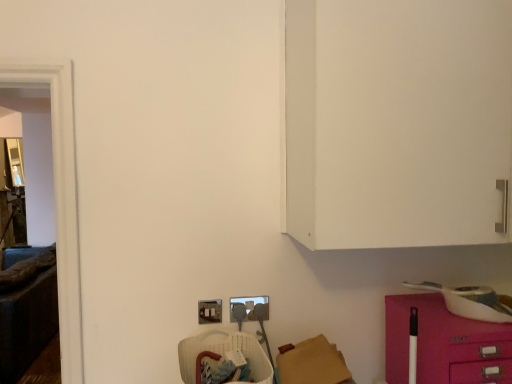
Question: From the image's perspective, is transparent glass door at left beneath metallic silver electric outlet at lower center, which is the 2th electric outlet from right to left?

Choices:
 (A) no
 (B) yes

Answer: (A)

Question: From the image's perspective, would you say transparent glass door at left is positioned over metallic silver electric outlet at lower center, which is the 2th electric outlet from right to left?

Choices:
 (A) yes
 (B) no

Answer: (A)

Question: Can you confirm if transparent glass door at left is thinner than metallic silver electric outlet at lower center, arranged as the 1th electric outlet when viewed from the left?

Choices:
 (A) yes
 (B) no

Answer: (B)

Question: Is transparent glass door at left positioned far away from metallic silver electric outlet at lower center, which is the 2th electric outlet from right to left?

Choices:
 (A) no
 (B) yes

Answer: (A)

Question: From a real-world perspective, is transparent glass door at left physically above metallic silver electric outlet at lower center, which is the 2th electric outlet from right to left?

Choices:
 (A) yes
 (B) no

Answer: (A)

Question: Does transparent glass door at left turn towards metallic silver electric outlet at lower center, arranged as the 1th electric outlet when viewed from the left?

Choices:
 (A) yes
 (B) no

Answer: (B)

Question: Does translucent plastic basket at lower center have a greater height compared to transparent glass door at left?

Choices:
 (A) no
 (B) yes

Answer: (A)

Question: Is translucent plastic basket at lower center aimed at transparent glass door at left?

Choices:
 (A) no
 (B) yes

Answer: (A)

Question: Does translucent plastic basket at lower center have a lesser height compared to transparent glass door at left?

Choices:
 (A) yes
 (B) no

Answer: (A)

Question: From the image's perspective, is translucent plastic basket at lower center under transparent glass door at left?

Choices:
 (A) yes
 (B) no

Answer: (A)

Question: Is translucent plastic basket at lower center located outside transparent glass door at left?

Choices:
 (A) no
 (B) yes

Answer: (B)

Question: From a real-world perspective, is translucent plastic basket at lower center physically above transparent glass door at left?

Choices:
 (A) no
 (B) yes

Answer: (A)

Question: From the image's perspective, is metallic silver electric outlet at lower center, which is the 2th electric outlet from right to left, beneath pink glossy drawer at lower right?

Choices:
 (A) yes
 (B) no

Answer: (B)